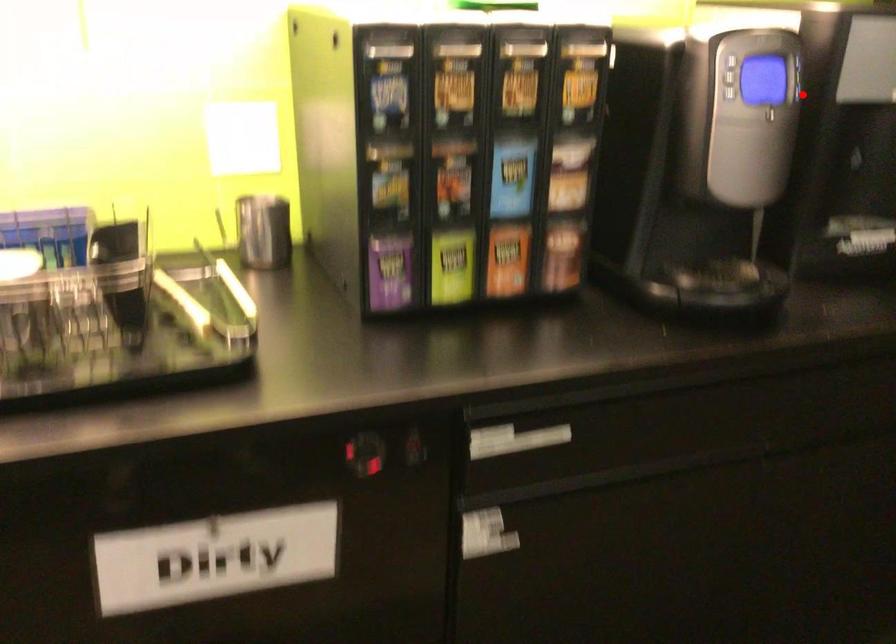
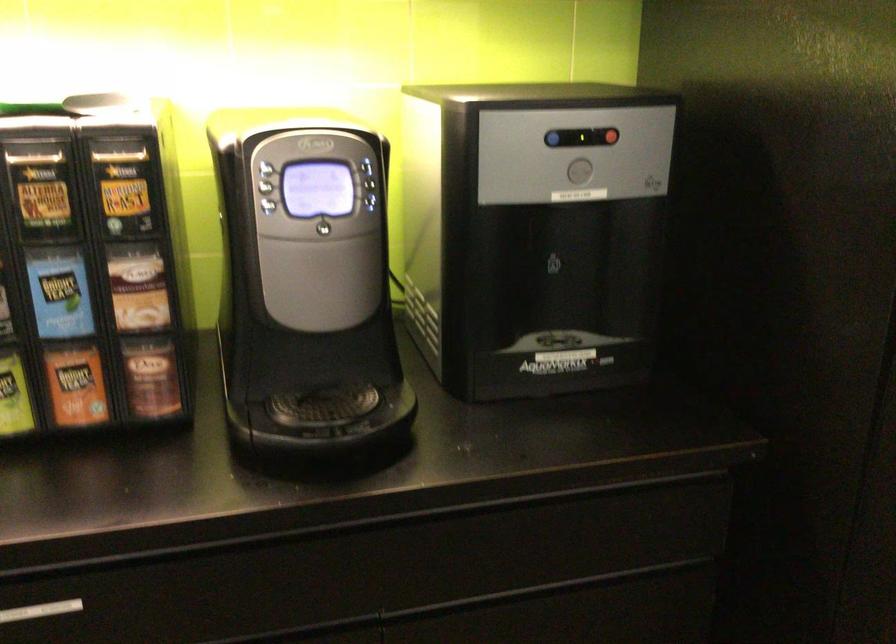
The point at the highlighted location is marked in the first image. Where is the corresponding point in the second image?

(375, 204)